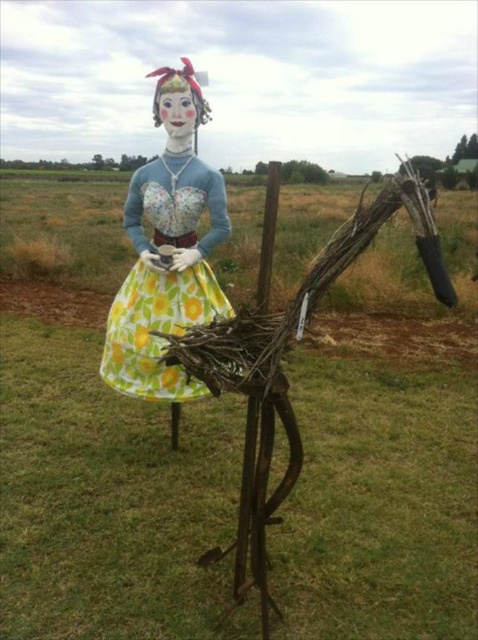
Between yellow floral dress at center and floral fabric dress at center, which one appears on the left side from the viewer's perspective?

floral fabric dress at center is more to the left.

Is yellow floral dress at center to the left of floral fabric dress at center from the viewer's perspective?

No, yellow floral dress at center is not to the left of floral fabric dress at center.

This screenshot has height=640, width=478. I want to click on yellow floral dress at center, so click(x=99, y=451).